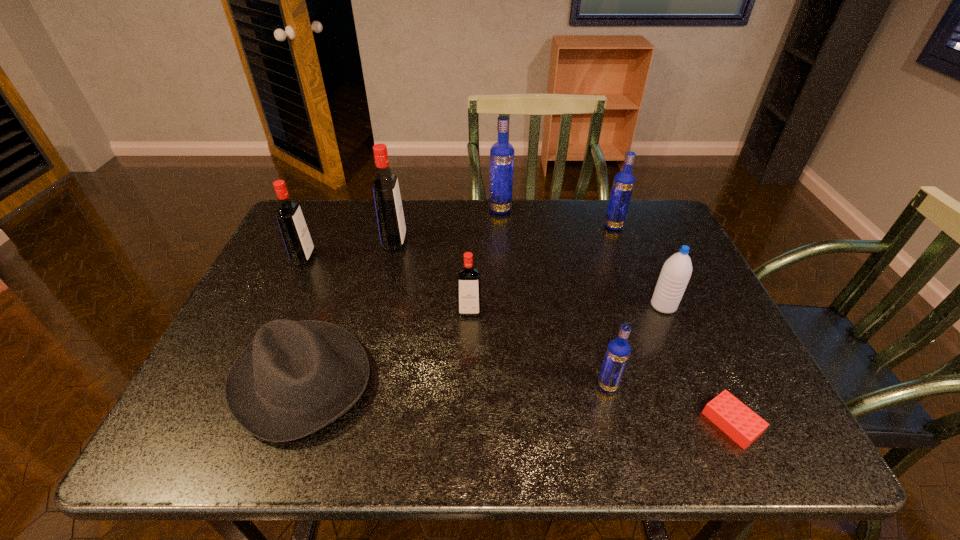
The width and height of the screenshot is (960, 540). In order to click on free location at the far right corner of the desktop in this screenshot , I will do `click(683, 241)`.

Locate an element on the screen. vacant space that's between the gray fedora and the sixth object from left to right is located at coordinates (454, 383).

Image resolution: width=960 pixels, height=540 pixels. I want to click on vacant area that lies between the water bottle and the eighth tallest object, so click(482, 343).

You are a GUI agent. You are given a task and a screenshot of the screen. Output one action in this format:
    pyautogui.click(x=<x>, y=<y>)
    Task: Click on the empty location between the second blue vodka from left to right and the blue water bottle
    The height and width of the screenshot is (540, 960).
    Given the screenshot: What is the action you would take?
    pyautogui.click(x=636, y=346)

At what (x,y) coordinates should I click in order to perform the action: click on vacant point located between the rightmost red vodka and the fifth nearest vodka. Please return your answer as a coordinate pair (x, y). Looking at the image, I should click on (541, 269).

Find the location of a particular element. vacant point located between the biggest blue vodka and the Lego is located at coordinates 616,316.

At what (x,y) coordinates should I click in order to perform the action: click on free spot between the second red vodka from right to left and the rightmost blue vodka. Please return your answer as a coordinate pair (x, y). Image resolution: width=960 pixels, height=540 pixels. Looking at the image, I should click on (504, 234).

Image resolution: width=960 pixels, height=540 pixels. Find the location of `free space between the fedora and the leftmost red vodka`. free space between the fedora and the leftmost red vodka is located at coordinates tap(302, 319).

Image resolution: width=960 pixels, height=540 pixels. I want to click on vacant space that is in between the farthest blue vodka and the biggest red vodka, so click(x=447, y=226).

What are the coordinates of `empty location between the Lego and the second vodka from left to right` in the screenshot? It's located at (564, 333).